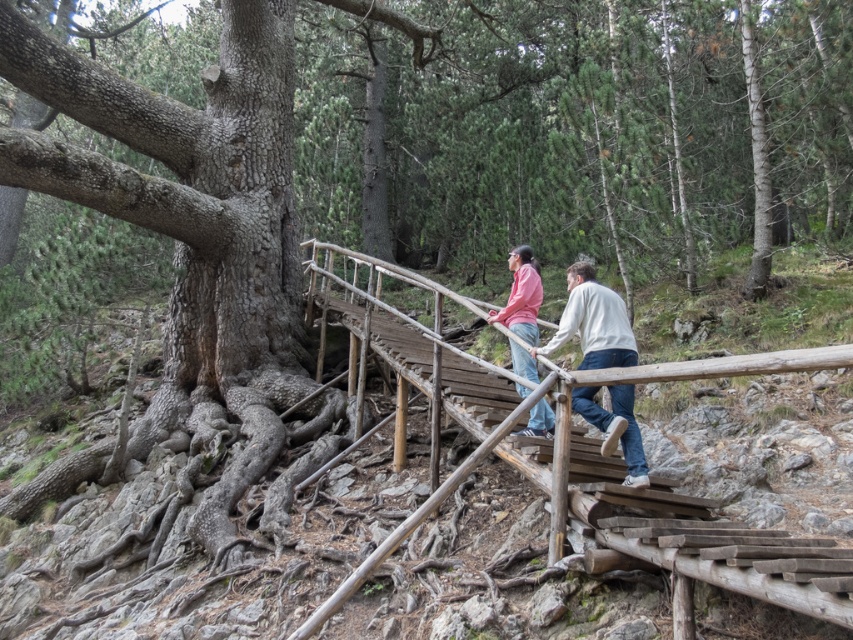
You are standing at the base of the wooden bridge and want to locate the wooden rail at center. According to the coordinates provided, where would you look relative to the bridge?

The wooden rail at center is located at the coordinates point (672, 529), which would be towards the upper right section of the bridge from the base.

Based on the scene description, where is the wooden rail at center located in the image?

The wooden rail at center is located at point (672, 529) in the image.